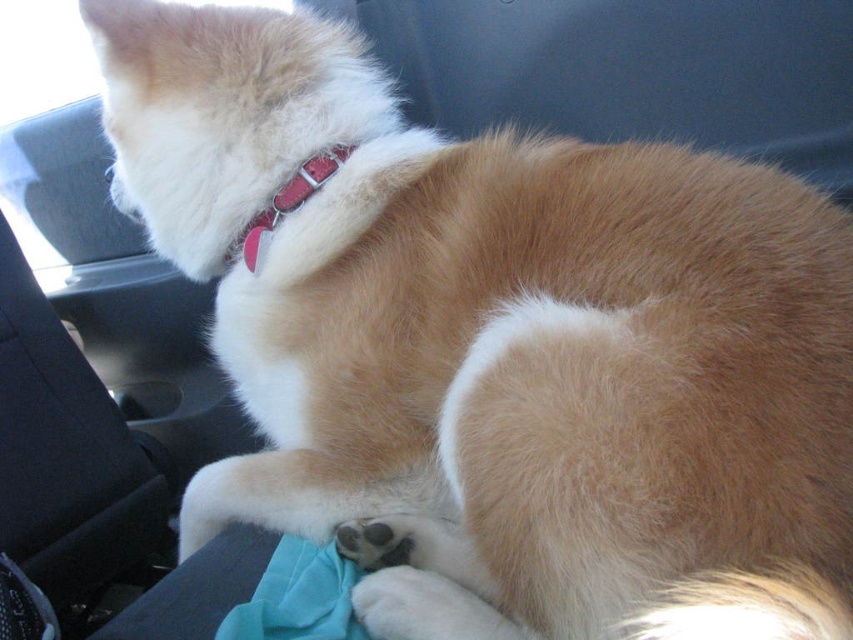
Question: Which object is closer to the camera taking this photo?

Choices:
 (A) matte red collar at upper center
 (B) red leather collar at upper center

Answer: (B)

Question: Is teal fabric at lower center smaller than red leather collar at upper center?

Choices:
 (A) no
 (B) yes

Answer: (B)

Question: Estimate the real-world distances between objects in this image. Which object is closer to the matte red collar at upper center?

Choices:
 (A) red leather collar at upper center
 (B) teal fabric at lower center

Answer: (A)

Question: Is teal fabric at lower center further to the viewer compared to red leather collar at upper center?

Choices:
 (A) yes
 (B) no

Answer: (B)

Question: Which object appears closest to the camera in this image?

Choices:
 (A) red leather collar at upper center
 (B) matte red collar at upper center
 (C) teal fabric at lower center

Answer: (C)

Question: Does teal fabric at lower center appear on the right side of red leather collar at upper center?

Choices:
 (A) yes
 (B) no

Answer: (A)